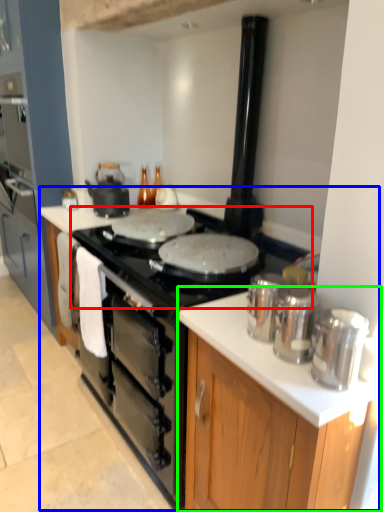
Question: Estimate the real-world distances between objects in this image. Which object is farther from gas stove (highlighted by a red box), counter top (highlighted by a blue box) or cabinetry (highlighted by a green box)?

Choices:
 (A) counter top
 (B) cabinetry

Answer: (B)